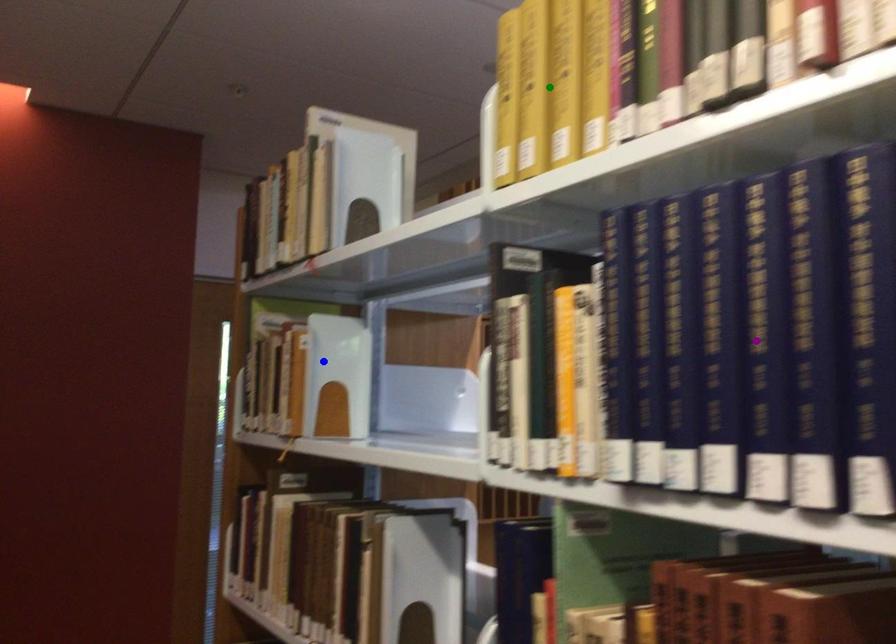
Order these from nearest to farthest:
1. green point
2. blue point
3. purple point

purple point → green point → blue point